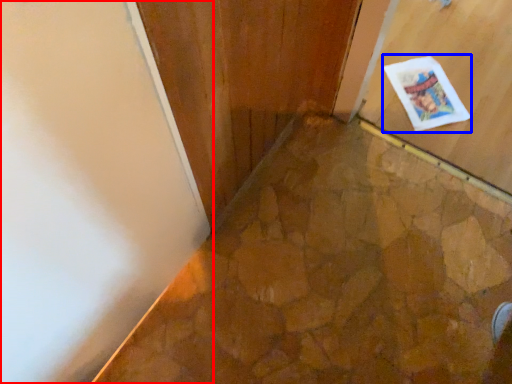
Question: Which of the following is the closest to the observer, door (highlighted by a red box) or postcard (highlighted by a blue box)?

Choices:
 (A) door
 (B) postcard

Answer: (A)